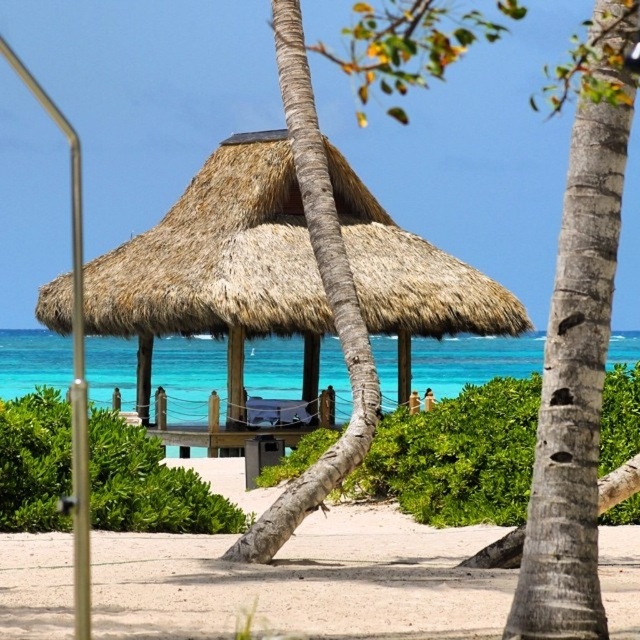
Question: Is gray textured palm tree at right positioned behind turquoise water at center?

Choices:
 (A) yes
 (B) no

Answer: (B)

Question: Does thatched straw hut at center come in front of brown rough palm tree at center?

Choices:
 (A) yes
 (B) no

Answer: (B)

Question: Which of the following is the closest to the observer?

Choices:
 (A) gray textured palm tree at right
 (B) brown rough palm tree at center
 (C) turquoise water at center

Answer: (A)

Question: Which point is closer to the camera?

Choices:
 (A) (422, 369)
 (B) (616, 188)
 (C) (51, 321)

Answer: (B)

Question: Does thatched straw hut at center appear on the right side of turquoise water at center?

Choices:
 (A) yes
 (B) no

Answer: (A)

Question: Which of these objects is positioned farthest from the gray textured palm tree at right?

Choices:
 (A) turquoise water at center
 (B) brown rough palm tree at center
 (C) thatched straw hut at center

Answer: (A)